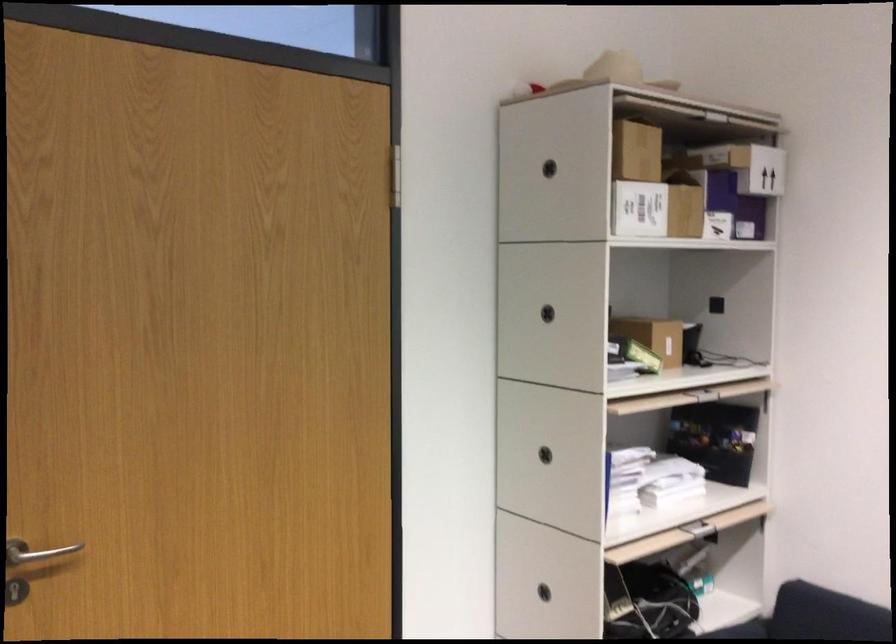
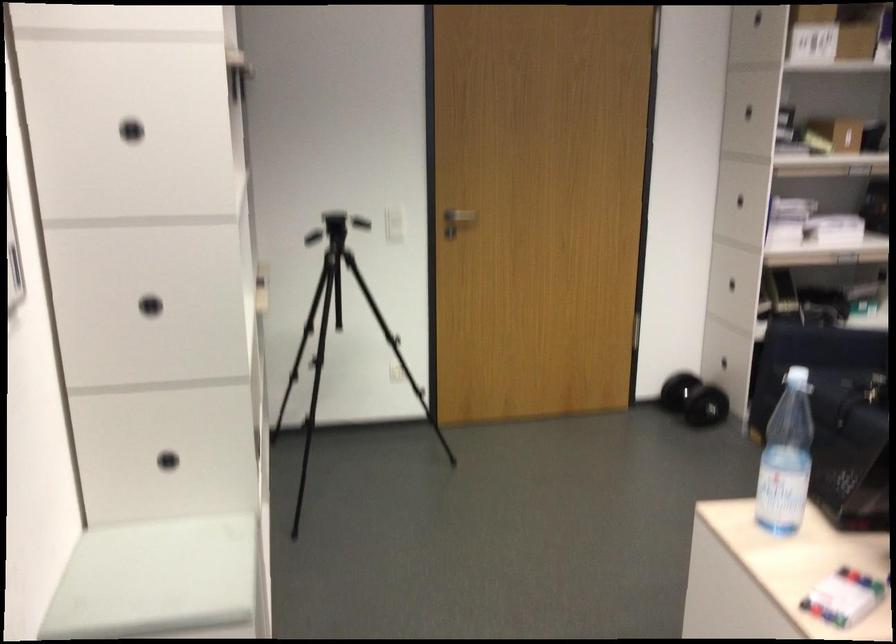
Locate, in the second image, the point that corresponds to [549,312] in the first image.

(747, 111)